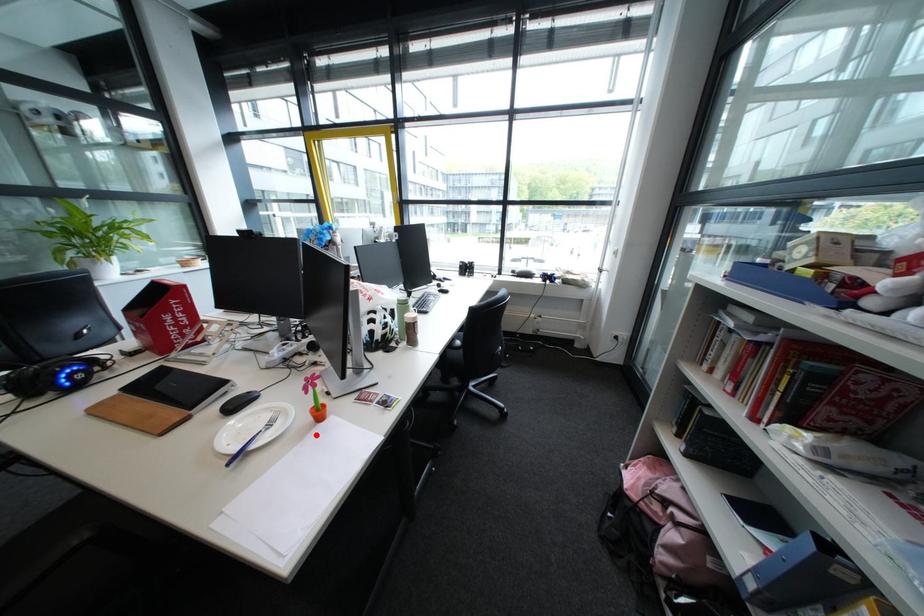
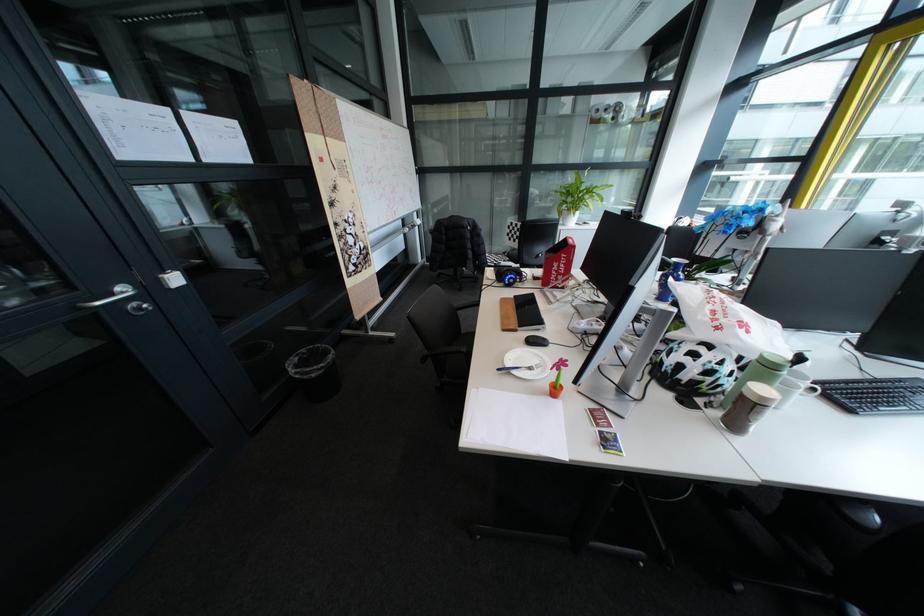
Find the pixel in the second image that matches the highlighted location in the first image.

(551, 392)